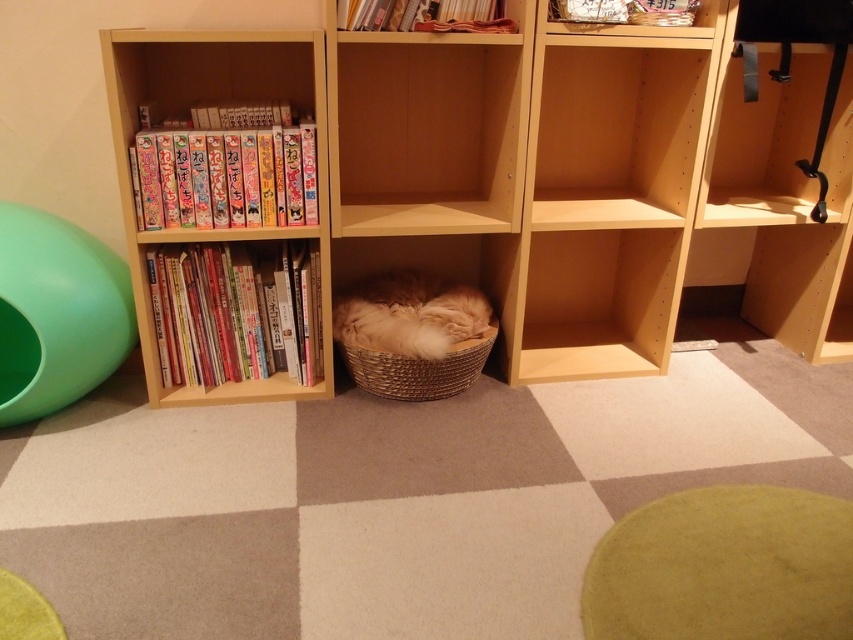
Question: Can you confirm if natural wood bookcase at left is thinner than hardcover books at left?

Choices:
 (A) yes
 (B) no

Answer: (B)

Question: Considering the real-world distances, which object is closest to the natural wood bookcase at left?

Choices:
 (A) matte paper manga at left
 (B) wooden bookshelf at left
 (C) fuzzy beige cat at center
 (D) hardcover books at left

Answer: (C)

Question: Which point is closer to the camera?

Choices:
 (A) hardcover books at left
 (B) natural wood bookcase at left

Answer: (B)

Question: Which of these objects is positioned farthest from the hardcover book at upper center?

Choices:
 (A) fuzzy beige cat at center
 (B) light wood/unfinished wood shelf at center
 (C) natural wood bookcase at left
 (D) hardcover books at left

Answer: (D)

Question: Does natural wood bookcase at left appear under light wood/unfinished wood shelf at center?

Choices:
 (A) no
 (B) yes

Answer: (B)

Question: Does green rubber ball at left appear on the right side of fuzzy beige cat at center?

Choices:
 (A) yes
 (B) no

Answer: (B)